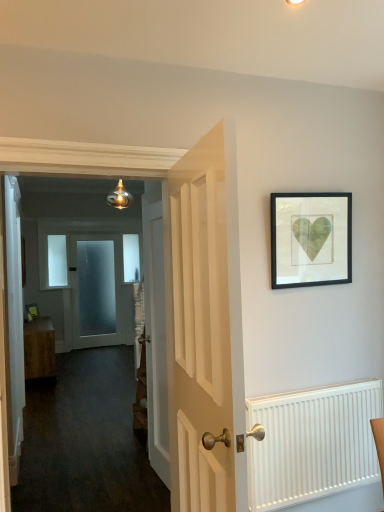
Question: Should I look upward or downward to see white wooden door at center, marked as the 2th door in a right-to-left arrangement?

Choices:
 (A) up
 (B) down

Answer: (B)

Question: Can you confirm if black matte picture frame at upper right is taller than white wooden door at center, the 2th door from the back?

Choices:
 (A) no
 (B) yes

Answer: (A)

Question: Is white wooden door at center, positioned as the 2th door in left-to-right order, a part of black matte picture frame at upper right?

Choices:
 (A) yes
 (B) no

Answer: (B)

Question: Is black matte picture frame at upper right not inside white wooden door at center, which is the second door from front to back?

Choices:
 (A) yes
 (B) no

Answer: (A)

Question: Is black matte picture frame at upper right at the right side of white wooden door at center, which is the second door from front to back?

Choices:
 (A) yes
 (B) no

Answer: (A)

Question: Is black matte picture frame at upper right beside white wooden door at center, which is the second door from front to back?

Choices:
 (A) yes
 (B) no

Answer: (B)

Question: Can you confirm if black matte picture frame at upper right is positioned to the left of white wooden door at center, the 2th door from the back?

Choices:
 (A) yes
 (B) no

Answer: (B)

Question: Is smooth white door at center at the left side of wooden cabinet at left?

Choices:
 (A) no
 (B) yes

Answer: (A)

Question: Can you confirm if smooth white door at center is shorter than wooden cabinet at left?

Choices:
 (A) yes
 (B) no

Answer: (B)

Question: Can you see smooth white door at center touching wooden cabinet at left?

Choices:
 (A) no
 (B) yes

Answer: (A)

Question: Considering the relative sizes of smooth white door at center and wooden cabinet at left in the image provided, is smooth white door at center thinner than wooden cabinet at left?

Choices:
 (A) no
 (B) yes

Answer: (B)

Question: Does smooth white door at center contain wooden cabinet at left?

Choices:
 (A) no
 (B) yes

Answer: (A)

Question: From the image's perspective, does smooth white door at center appear higher than wooden cabinet at left?

Choices:
 (A) no
 (B) yes

Answer: (B)

Question: Is frosted glass door at center, placed as the 1th door when sorted from left to right, not close to clear glass window at upper left, which appears as the 1th window when viewed from the front?

Choices:
 (A) yes
 (B) no

Answer: (B)